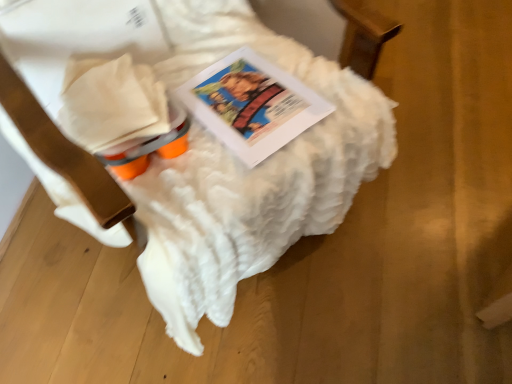
Question: From a real-world perspective, is white fluffy blanket at upper center positioned over matte paper book at center based on gravity?

Choices:
 (A) yes
 (B) no

Answer: (A)

Question: Considering the relative sizes of white fluffy blanket at upper center and matte paper book at center in the image provided, is white fluffy blanket at upper center wider than matte paper book at center?

Choices:
 (A) no
 (B) yes

Answer: (B)

Question: From the image's perspective, would you say white fluffy blanket at upper center is shown under matte paper book at center?

Choices:
 (A) yes
 (B) no

Answer: (B)

Question: Does white fluffy blanket at upper center appear on the right side of matte paper book at center?

Choices:
 (A) no
 (B) yes

Answer: (A)

Question: Is white fluffy blanket at upper center bigger than matte paper book at center?

Choices:
 (A) no
 (B) yes

Answer: (B)

Question: Is white fluffy blanket at upper center oriented towards matte paper book at center?

Choices:
 (A) no
 (B) yes

Answer: (B)

Question: Is matte paper book at center directly adjacent to white fluffy blanket at upper center?

Choices:
 (A) yes
 (B) no

Answer: (B)

Question: Considering the relative sizes of matte paper book at center and white fluffy blanket at upper center in the image provided, is matte paper book at center bigger than white fluffy blanket at upper center?

Choices:
 (A) yes
 (B) no

Answer: (B)

Question: From a real-world perspective, is matte paper book at center positioned under white fluffy blanket at upper center based on gravity?

Choices:
 (A) no
 (B) yes

Answer: (B)

Question: Does matte paper book at center appear on the left side of white fluffy blanket at upper center?

Choices:
 (A) no
 (B) yes

Answer: (A)

Question: Can you confirm if matte paper book at center is positioned to the right of white fluffy blanket at upper center?

Choices:
 (A) no
 (B) yes

Answer: (B)

Question: Can you confirm if matte paper book at center is thinner than white fluffy blanket at upper center?

Choices:
 (A) yes
 (B) no

Answer: (A)

Question: Would you say matte paper book at center is inside or outside white fluffy blanket at upper center?

Choices:
 (A) outside
 (B) inside

Answer: (B)